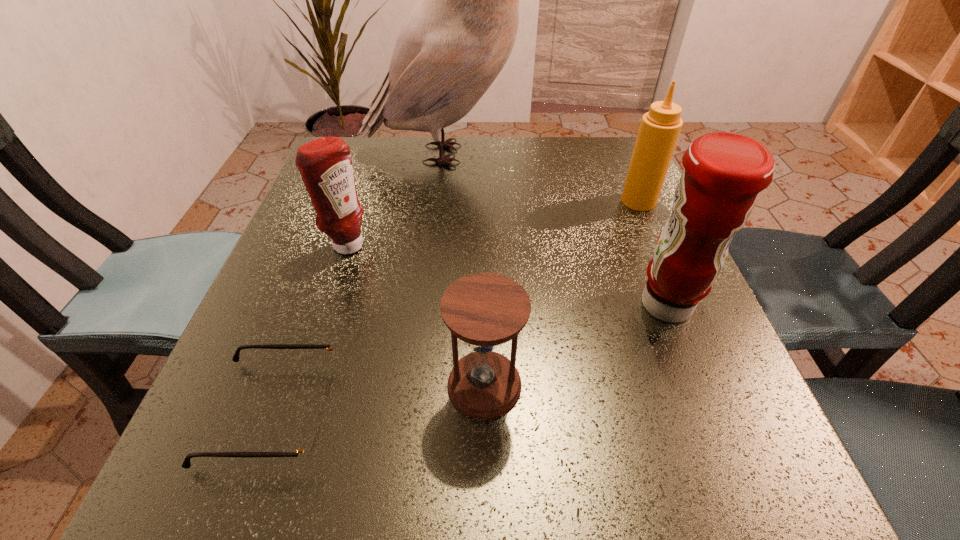
Identify the location of free space located 0.150m on the back of the farthest condiment. The height and width of the screenshot is (540, 960). (619, 157).

I want to click on vacant area located 0.150m on the right of the third farthest object, so [445, 245].

At what (x,y) coordinates should I click in order to perform the action: click on vacant space located on the right of the second shortest object. Please return your answer as a coordinate pair (x, y). The image size is (960, 540). Looking at the image, I should click on (612, 385).

Identify the location of vacant space located at the hinge ends of the spectacles. (406, 413).

I want to click on object that is at the far edge, so click(457, 39).

Where is `object located in the near edge section of the desktop`? object located in the near edge section of the desktop is located at coordinates (308, 446).

Find the location of a particular element. parakeet located at the left edge is located at coordinates (457, 39).

Locate an element on the screen. condiment present at the left edge is located at coordinates (325, 164).

Identify the location of spectacles that is positioned at the left edge. (308, 446).

I want to click on object that is at the far left corner, so coord(457,39).